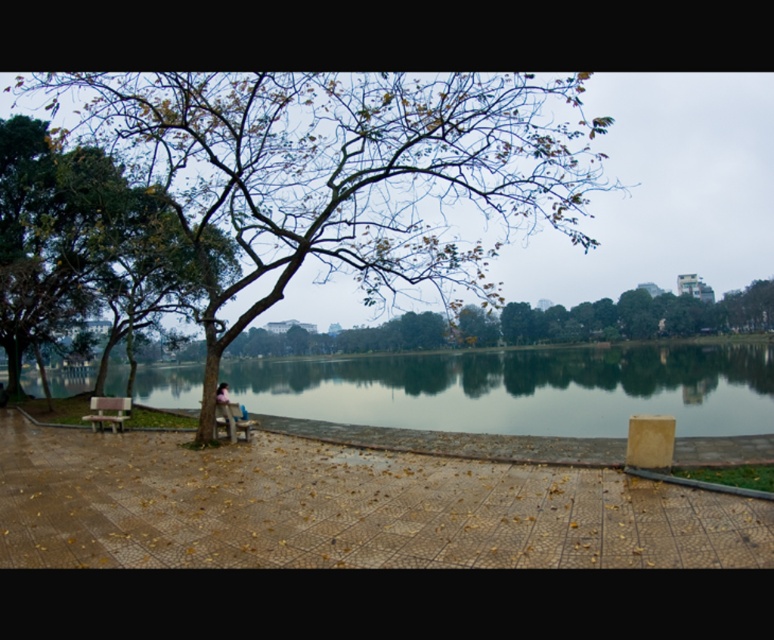
Question: Does wooden bench at center appear on the left side of pink fabric person at lower center?

Choices:
 (A) no
 (B) yes

Answer: (A)

Question: Can you confirm if wooden bench at lower left is positioned to the right of pink fabric person at lower center?

Choices:
 (A) no
 (B) yes

Answer: (A)

Question: Which point is closer to the camera?

Choices:
 (A) bare branches at center
 (B) wooden bench at lower left

Answer: (A)

Question: From the image, what is the correct spatial relationship of green reflective water at center in relation to pink fabric person at lower center?

Choices:
 (A) right
 (B) left

Answer: (A)

Question: Based on their relative distances, which object is nearer to the green leafy tree at center?

Choices:
 (A) wooden bench at lower left
 (B) wooden bench at center
 (C) green reflective water at center
 (D) pink fabric person at lower center

Answer: (B)

Question: Which is farther from the green leafy tree at center?

Choices:
 (A) wooden bench at center
 (B) bare branches at center
 (C) wooden bench at lower left

Answer: (B)